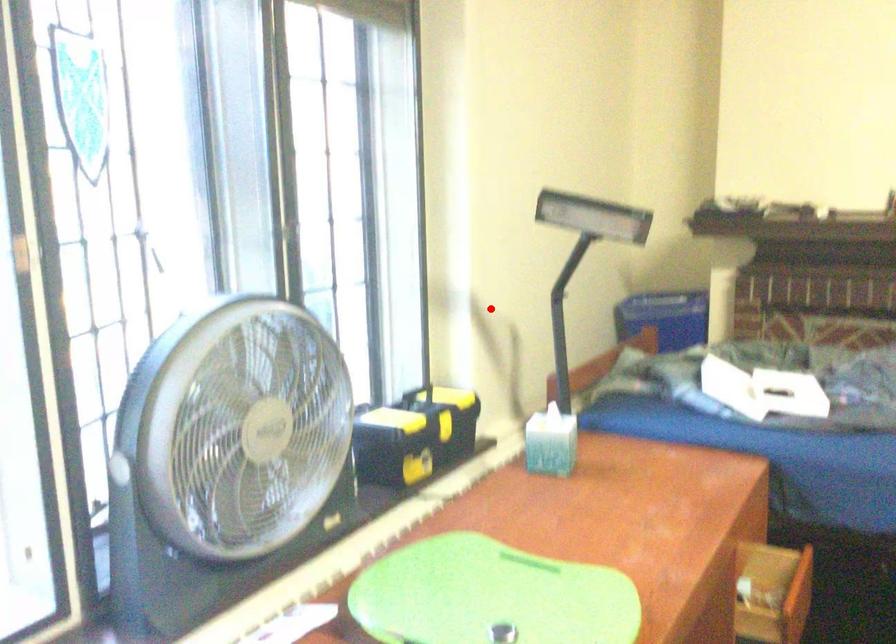
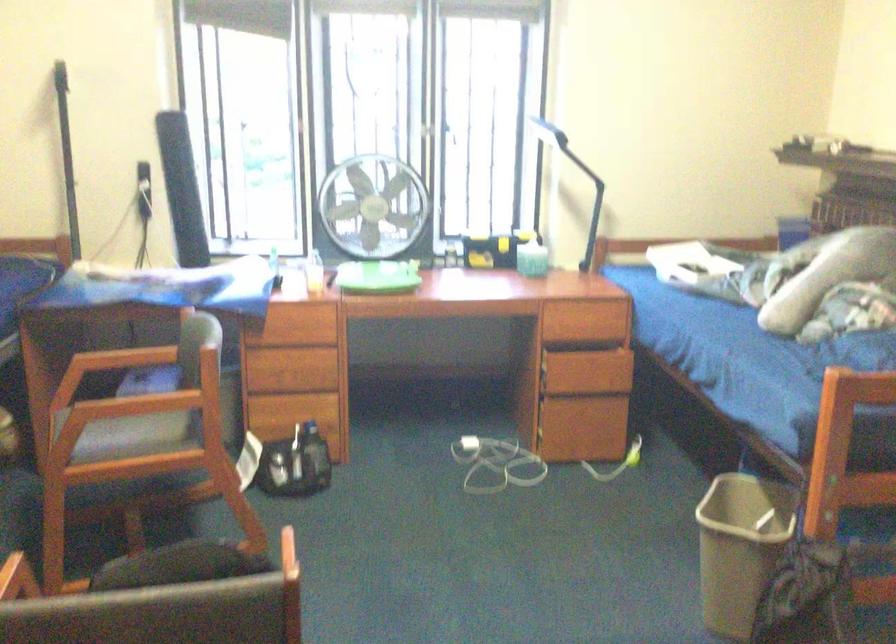
In the second image, find the point that corresponds to the highlighted location in the first image.

(573, 178)